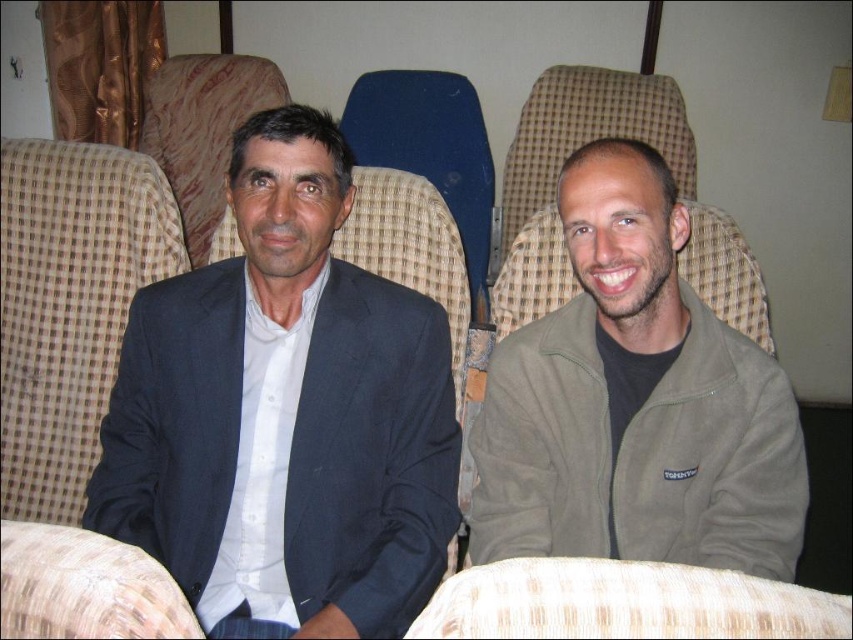
Question: Which object appears farthest from the camera in this image?

Choices:
 (A) dark blue suit at center
 (B) matte green jacket at right

Answer: (B)

Question: Is dark blue suit at center wider than matte green jacket at right?

Choices:
 (A) no
 (B) yes

Answer: (B)

Question: Among these points, which one is farthest from the camera?

Choices:
 (A) (271, 497)
 (B) (556, 352)

Answer: (A)

Question: Does dark blue suit at center appear on the left side of matte green jacket at right?

Choices:
 (A) yes
 (B) no

Answer: (A)

Question: Does dark blue suit at center appear on the left side of matte green jacket at right?

Choices:
 (A) no
 (B) yes

Answer: (B)